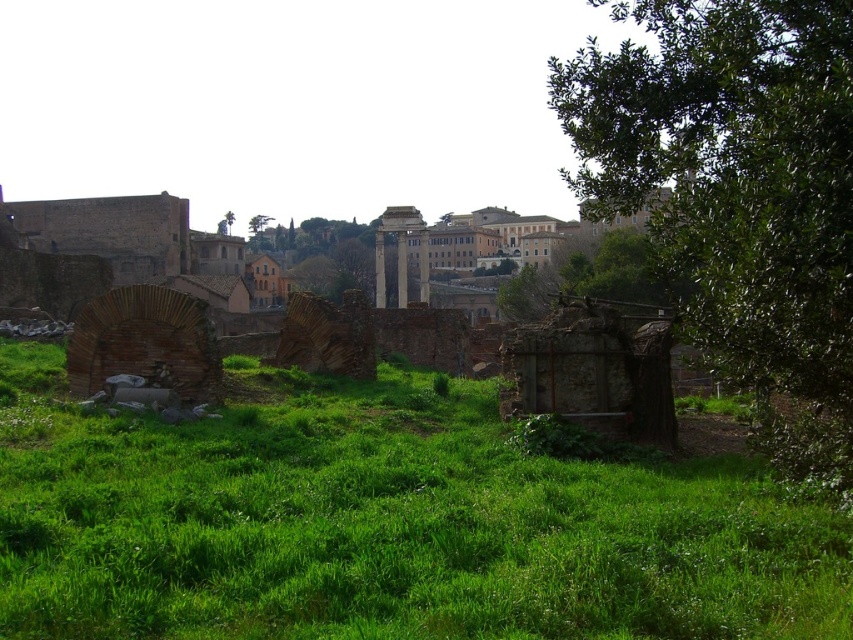
You are a landscape photographer planning to capture the entire scene in one shot. Given that your camera can only focus on objects within a 10m width, will the green grassy at center and the green leafy tree at upper center both fit within the camera frame?

The green grassy at center has a larger width than the green leafy tree at upper center. Since the camera can focus on objects within a 10m width, both objects will fit as their combined width is less than 10m.

You are standing in the ancient ruins and want to take a photo of both the green leafy tree at right and the green leafy tree at upper center. Which direction should you face to have both trees in your camera view?

To capture both the green leafy tree at right and the green leafy tree at upper center in your camera view, you should face towards the left since the green leafy tree at right is positioned to the right of the green leafy tree at upper center.